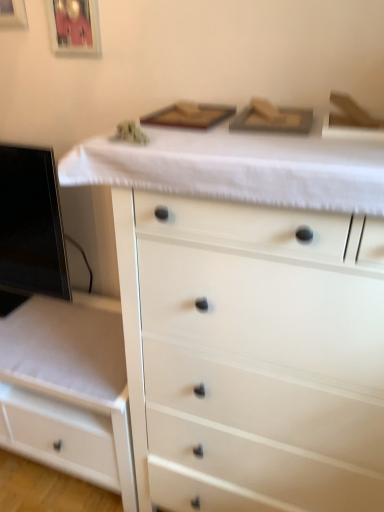
At what (x,y) coordinates should I click in order to perform the action: click on free point below black glossy computer monitor at left (from a real-world perspective). Please return your answer as a coordinate pair (x, y). Looking at the image, I should click on (33, 308).